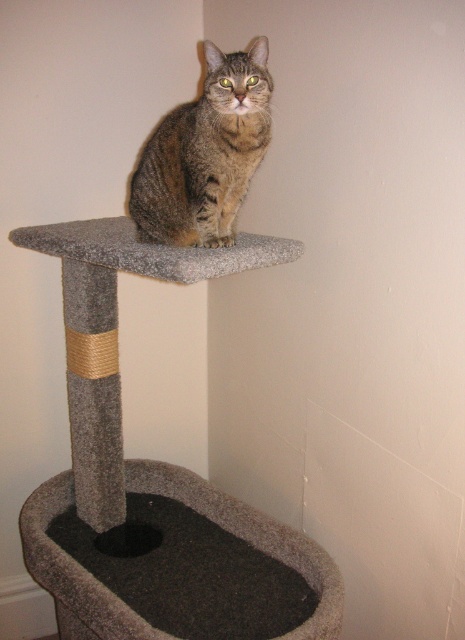
Is tabby fur cat at center wider than dark gray carpeted cat bed at lower center?

Incorrect, tabby fur cat at center's width does not surpass dark gray carpeted cat bed at lower center's.

Does tabby fur cat at center lie in front of dark gray carpeted cat bed at lower center?

No, it is not.

Between point (210, 115) and point (312, 579), which one is positioned in front?

Positioned in front is point (210, 115).

Where is `tabby fur cat at center`? tabby fur cat at center is located at coordinates (205, 154).